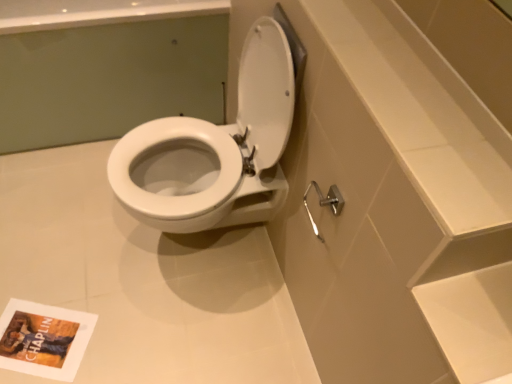
The height and width of the screenshot is (384, 512). I want to click on free spot above white glossy toilet at center (from a real-world perspective), so click(x=117, y=268).